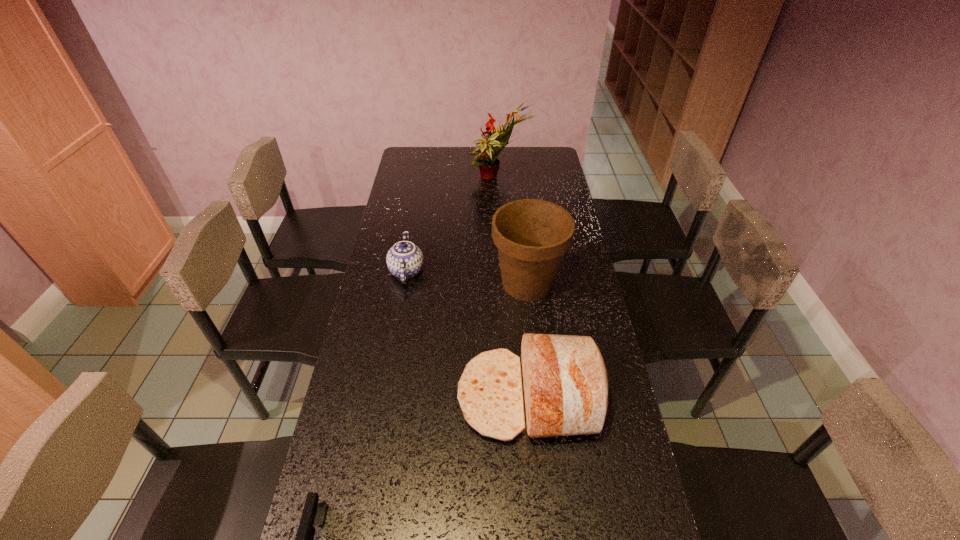
Where is `object that is at the far right corner`? Image resolution: width=960 pixels, height=540 pixels. object that is at the far right corner is located at coordinates (486, 159).

Identify the location of blank space at the far edge of the desktop. (522, 148).

In the image, there is a desktop. Where is `vacant space at the left edge`? vacant space at the left edge is located at coordinates (377, 502).

Locate an element on the screen. free space at the right edge of the desktop is located at coordinates (532, 176).

Where is `vacant region at the far left corner of the desktop`? The width and height of the screenshot is (960, 540). vacant region at the far left corner of the desktop is located at coordinates (423, 148).

You are a GUI agent. You are given a task and a screenshot of the screen. Output one action in this format:
    pyautogui.click(x=<x>, y=<y>)
    Task: Click on the vacant space at the far right corner of the desktop
    
    Given the screenshot: What is the action you would take?
    pyautogui.click(x=528, y=153)

Where is `free area in between the fourth object from right to left and the flowerpot`? The height and width of the screenshot is (540, 960). free area in between the fourth object from right to left and the flowerpot is located at coordinates (467, 277).

You are a GUI agent. You are given a task and a screenshot of the screen. Output one action in this format:
    pyautogui.click(x=<x>, y=<y>)
    Task: Click on the free spot between the fourth object from right to left and the flowerpot
    Image resolution: width=960 pixels, height=540 pixels.
    Given the screenshot: What is the action you would take?
    pyautogui.click(x=467, y=277)

Point out which object is positioned as the second nearest to the fourth shortest object. Please provide its 2D coordinates. Your answer should be formatted as a tuple, i.e. [(x, y)], where the tuple contains the x and y coordinates of a point satisfying the conditions above.

[(404, 260)]

Identify the location of the third closest object to the shortest object. (532, 235).